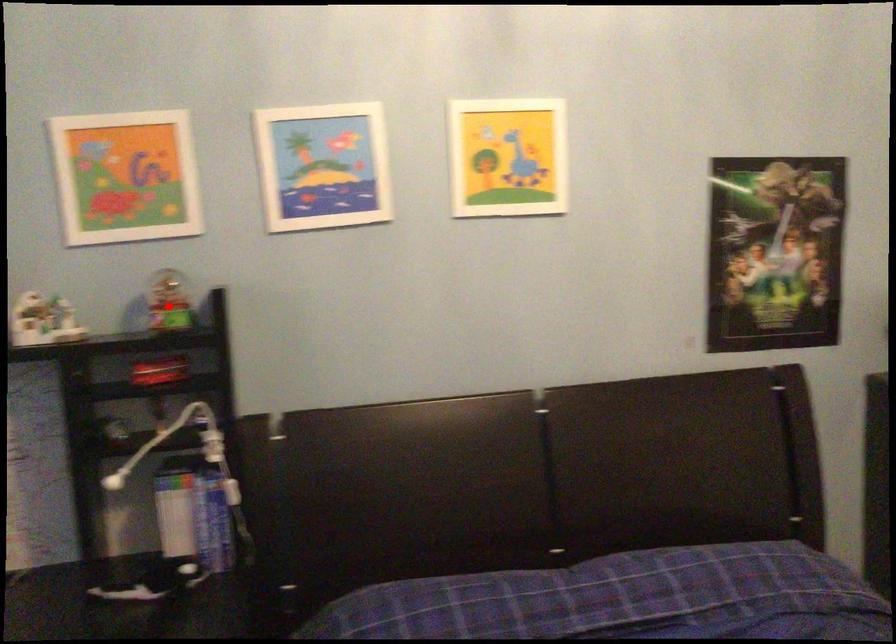
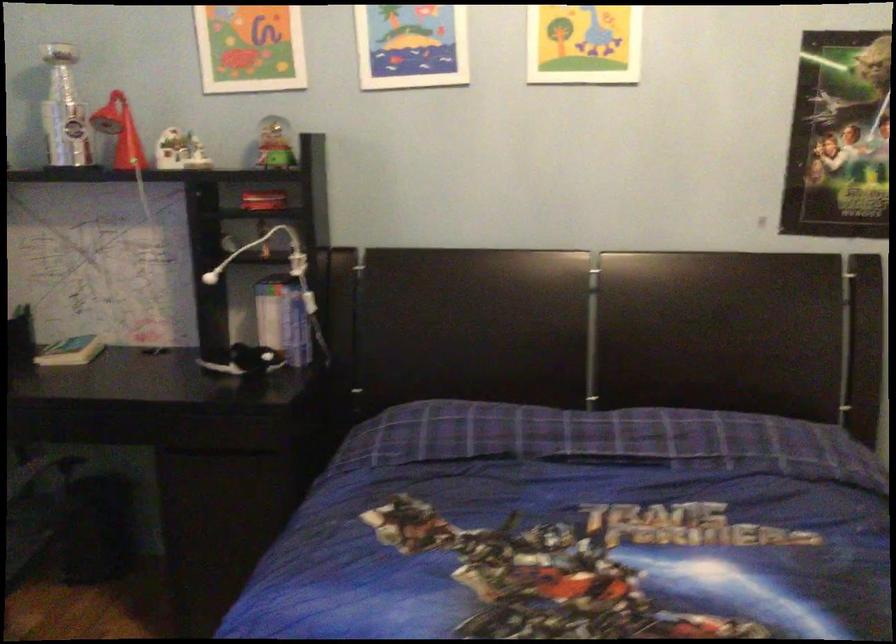
Find the pixel in the second image that matches the highlighted location in the first image.

(273, 144)